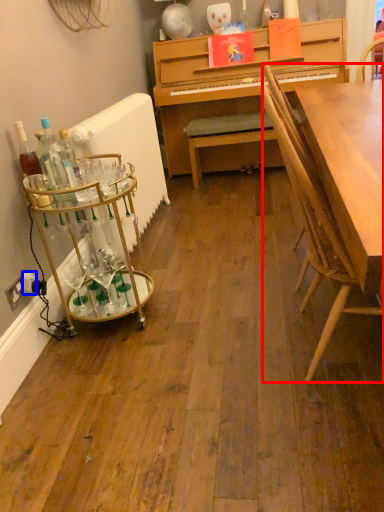
Question: Which point is further to the camera, chair (highlighted by a red box) or power outlet (highlighted by a blue box)?

Choices:
 (A) chair
 (B) power outlet

Answer: (B)